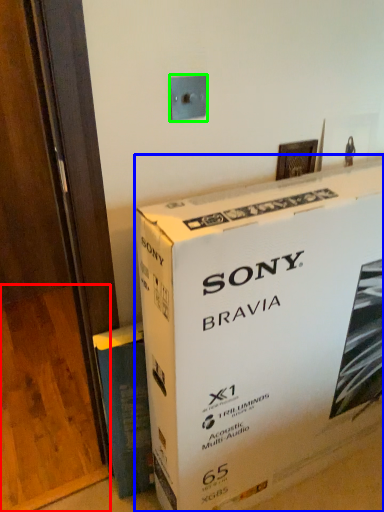
Question: Which object is positioned closest to plywood (highlighted by a red box)? Select from box (highlighted by a blue box) and electric outlet (highlighted by a green box).

Choices:
 (A) box
 (B) electric outlet

Answer: (A)